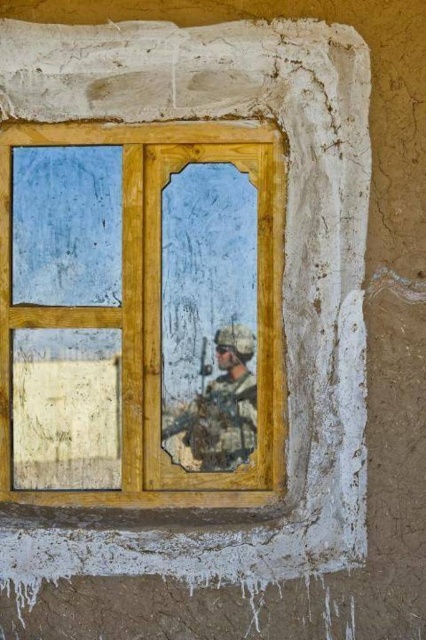
You are standing in front of a window in a mud wall. You notice two points marked on the wall. One is at point coordinates point (121,396) and the other is at point coordinates point (215,337). Which point is closer to you?

Point (121,396) is closer to the viewer than point (215,337).

You are standing in front of the wall with the weathered window. If you want to touch the wooden window frame at center, where should you aim your hand relative to the wall?

The wooden window frame at center is located at point (141, 314), so you should aim your hand at that coordinate on the wall.

You are a soldier in the camouflage fabric soldier at center. You want to look outside through the wooden window frame at center. Can you see the window frame above you?

The wooden window frame at center is above the camouflage fabric soldier at center, so yes, the soldier can see the window frame above them.